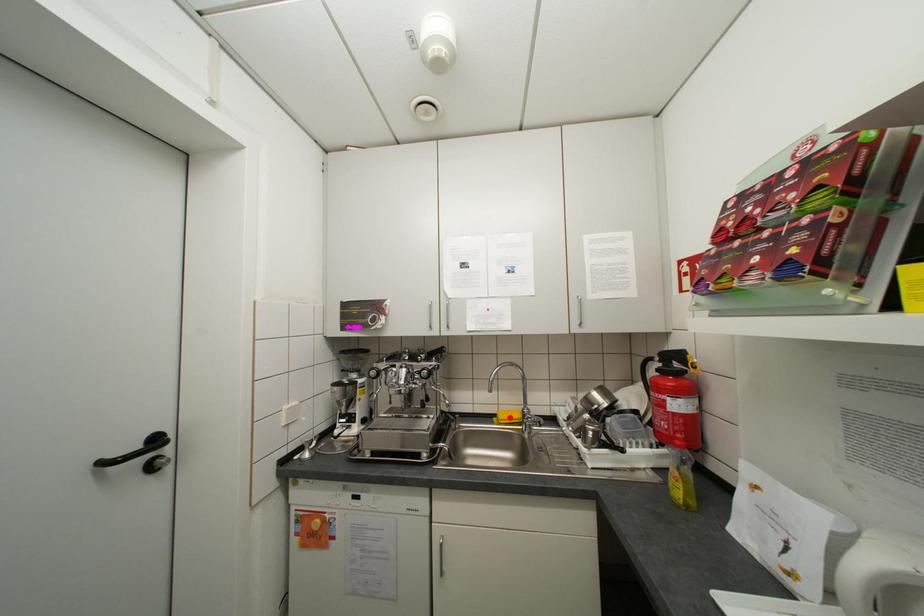
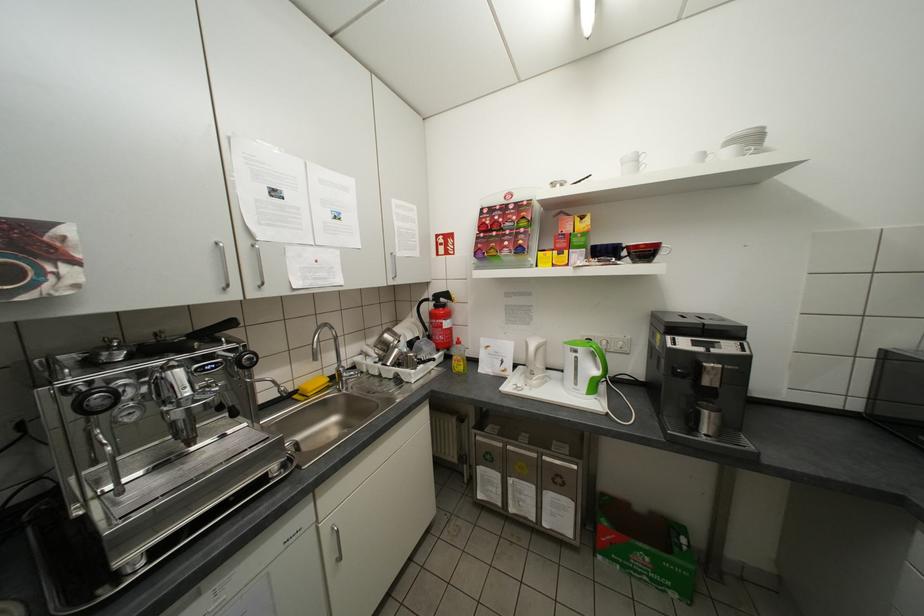
Question: I am providing you with two images of the same scene from different viewpoints. Given a red point in image1, look at the same physical point in image2. Is it:

Choices:
 (A) Closer to the viewpoint
 (B) Farther from the viewpoint

Answer: (A)